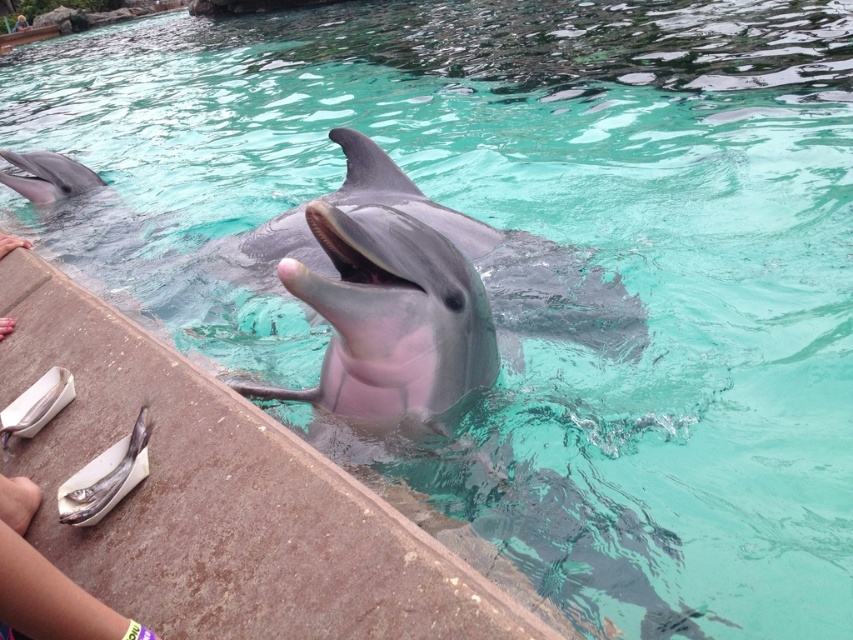
Looking at this image, who is shorter, smooth gray dolphin at center or skinny fish at lower left?

With less height is skinny fish at lower left.

Locate an element on the screen. This screenshot has height=640, width=853. smooth gray dolphin at center is located at coordinates (421, 298).

Between point (375, 189) and point (33, 483), which one is positioned behind?

Positioned behind is point (375, 189).

Identify the location of smooth gray dolphin at center. The height and width of the screenshot is (640, 853). (421, 298).

Does skinny fish at lower left have a greater width compared to shiny silver fish at lower left?

Indeed, skinny fish at lower left has a greater width compared to shiny silver fish at lower left.

In the scene shown: Who is positioned more to the left, skinny fish at lower left or shiny silver fish at lower left?

From the viewer's perspective, shiny silver fish at lower left appears more on the left side.

Between point (86, 602) and point (135, 468), which one is positioned behind?

Point (135, 468)

You are a GUI agent. You are given a task and a screenshot of the screen. Output one action in this format:
    pyautogui.click(x=<x>, y=<y>)
    Task: Click on the skinny fish at lower left
    
    Given the screenshot: What is the action you would take?
    pyautogui.click(x=45, y=580)

Between point (399, 216) and point (80, 483), which one is positioned in front?

Positioned in front is point (80, 483).

Identify the location of smooth gray dolphin at center. (421, 298).